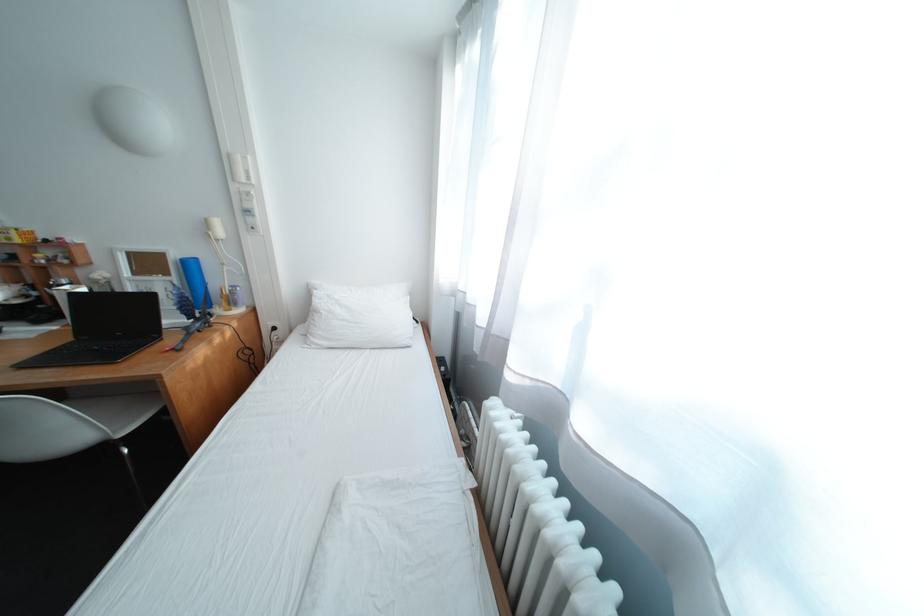
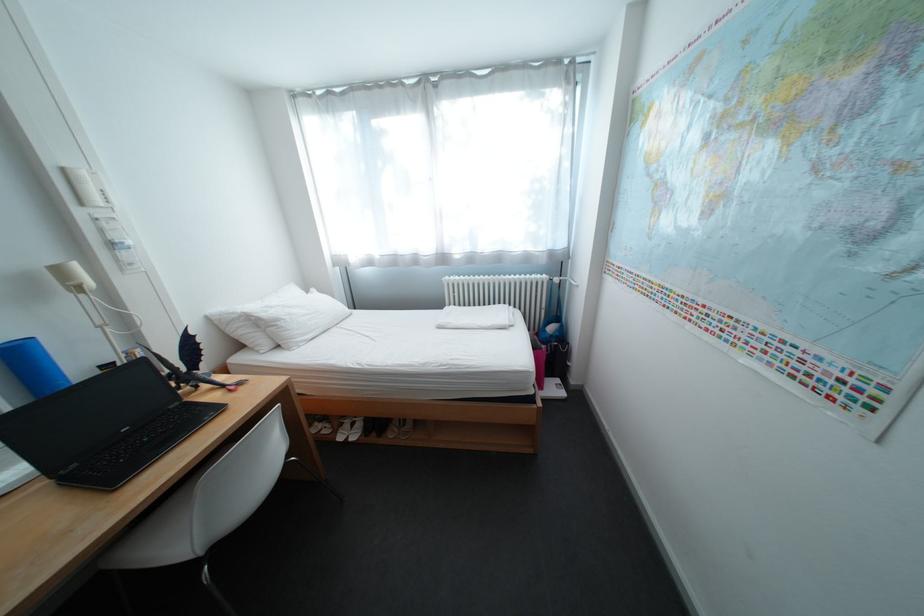
Locate, in the second image, the point that corresponds to point 130,334 in the first image.

(137, 431)